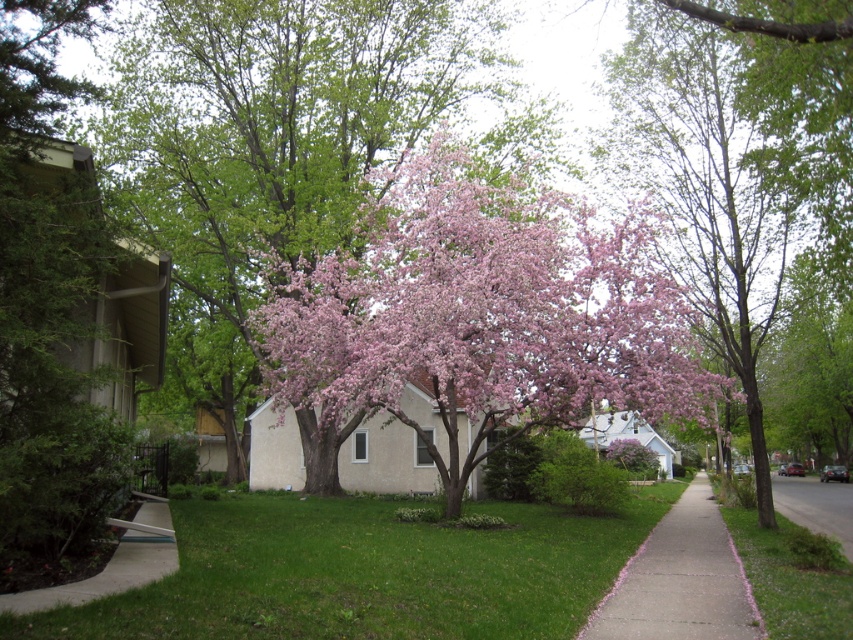
Is point (244, 177) in front of point (778, 301)?

No.

Is pink bloom tree at center to the right of pink blossoming tree at center from the viewer's perspective?

Incorrect, pink bloom tree at center is not on the right side of pink blossoming tree at center.

Between point (183, 76) and point (718, 125), which one is positioned behind?

The point (183, 76) is more distant.

This screenshot has width=853, height=640. Find the location of `pink bloom tree at center`. pink bloom tree at center is located at coordinates (277, 128).

Who is higher up, pink petal-covered sidewalk at center-right or asphalt pavement at lower right?

Positioned higher is pink petal-covered sidewalk at center-right.

Is point (589, 625) farther from viewer compared to point (782, 509)?

No, (589, 625) is closer to viewer.

Who is more distant from viewer, (645, 540) or (780, 509)?

Point (780, 509)

Where is `pink petal-covered sidewalk at center-right`? pink petal-covered sidewalk at center-right is located at coordinates (680, 580).

Is point (289, 305) positioned before point (683, 522)?

Yes.

Is pink bloom at center positioned behind pink petal-covered sidewalk at center-right?

Yes, it is.

Does point (532, 237) come closer to viewer compared to point (732, 604)?

No, (532, 237) is behind (732, 604).

Where is `pink bloom at center`? The image size is (853, 640). pink bloom at center is located at coordinates (485, 310).